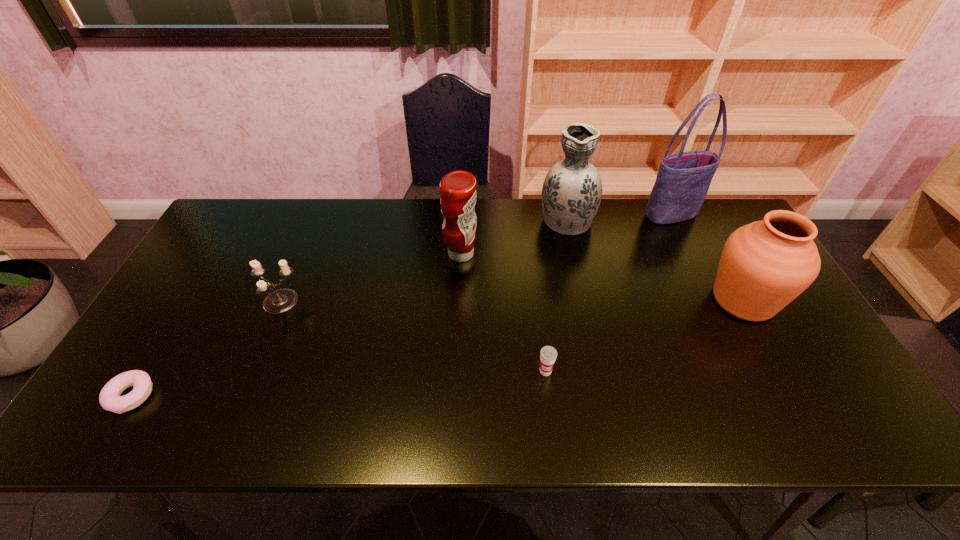
Identify the location of vacant space at the right edge of the desktop. (828, 396).

Find the location of a particular element. This screenshot has width=960, height=540. free spot between the fourth object from right to left and the third farthest object is located at coordinates (503, 313).

Identify the location of free space between the fifth object from left to right and the candle holder. The width and height of the screenshot is (960, 540). (423, 261).

This screenshot has height=540, width=960. In order to click on vacant point located between the candle holder and the second tallest object in this screenshot , I will do `click(423, 261)`.

Locate an element on the screen. vacant space in between the leftmost object and the urn is located at coordinates (438, 348).

The width and height of the screenshot is (960, 540). I want to click on vacant area that lies between the doughnut and the tallest object, so click(401, 305).

Locate an element on the screen. This screenshot has height=540, width=960. vacant area between the shortest object and the fifth nearest object is located at coordinates (297, 325).

Find the location of a particular element. The image size is (960, 540). vacant area between the cup and the fifth object from right to left is located at coordinates (503, 313).

Find the location of a particular element. This screenshot has width=960, height=540. free point between the third object from left to right and the tallest object is located at coordinates (565, 234).

The height and width of the screenshot is (540, 960). Find the location of `vacant space that's between the third farthest object and the tote bag`. vacant space that's between the third farthest object and the tote bag is located at coordinates (565, 234).